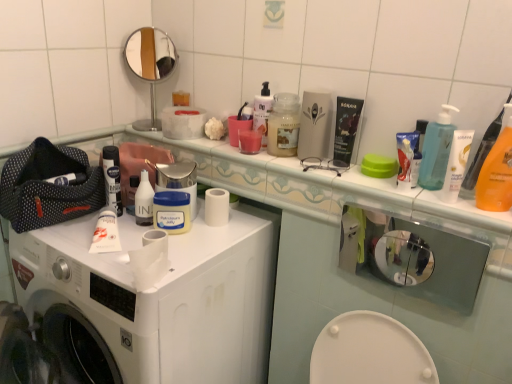
I want to click on unoccupied region to the right of white matte jar at center, the 3th mouthwash positioned from the right, so click(x=222, y=233).